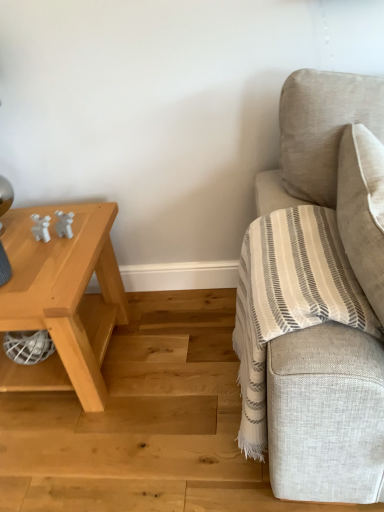
Identify the location of empty space that is ontop of natural wood stair at lower right (from a real-world perspective). Image resolution: width=384 pixels, height=512 pixels. (149, 410).